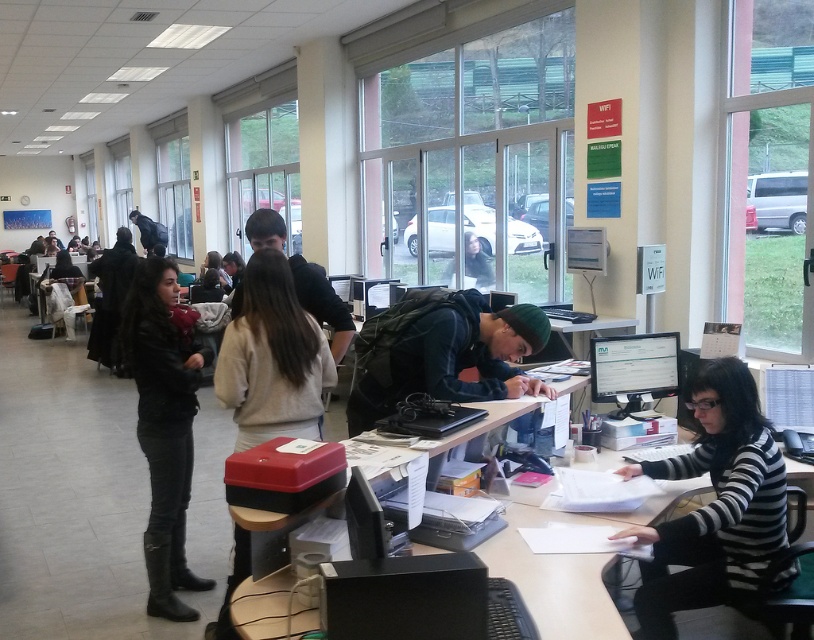
Question: Does striped sweater at right have a greater width compared to light beige sweater at center?

Choices:
 (A) no
 (B) yes

Answer: (B)

Question: Is striped sweater at right smaller than dark brown leather jacket at center?

Choices:
 (A) yes
 (B) no

Answer: (A)

Question: Which point is farther to the camera?

Choices:
 (A) (339, 314)
 (B) (771, 499)
 (C) (136, 358)

Answer: (A)

Question: Is black leather jacket at left wider than dark brown leather jacket at center?

Choices:
 (A) yes
 (B) no

Answer: (B)

Question: Among these points, which one is farthest from the camera?

Choices:
 (A) (395, 433)
 (B) (156, 529)

Answer: (B)

Question: Which object is positioned farthest from the black plastic computer at center?

Choices:
 (A) black matte laptop at center
 (B) dark brown hair at center

Answer: (B)